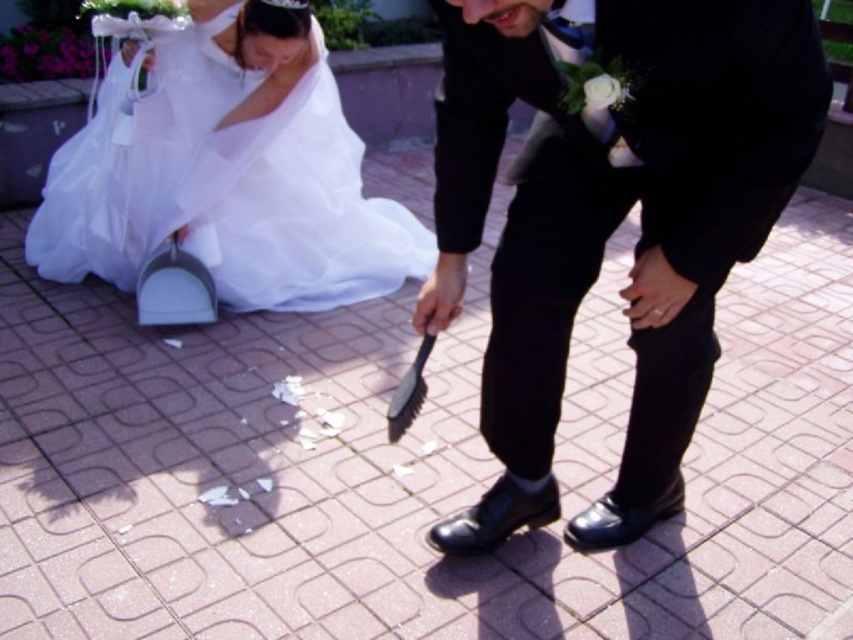
In the image of the wedding ceremony, there is a man in a black suit holding a small broom and a point marked at coordinates (611, 221). What object is located at this point?

The point at coordinates (611, 221) marks the location of the black leather shoes at lower center.

You are a photographer at the wedding and want to capture a closeup shot of the black leather shoes at lower center and the white sheer dress at lower left. Which object should you zoom in on first to ensure it fits entirely within the frame?

The black leather shoes at lower center occupies less space than the white sheer dress at lower left, so you should zoom in on the white sheer dress at lower left first to ensure it fits entirely within the frame.